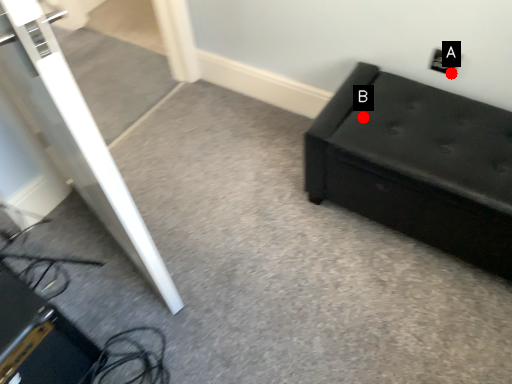
Question: Two points are circled on the image, labeled by A and B beside each circle. Which point is further to the camera?

Choices:
 (A) A is further
 (B) B is further

Answer: (A)